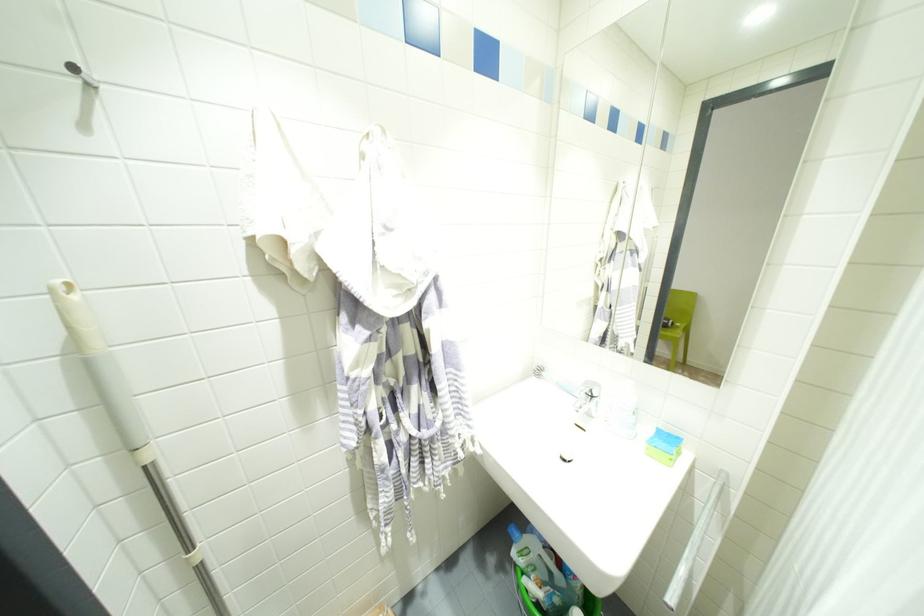
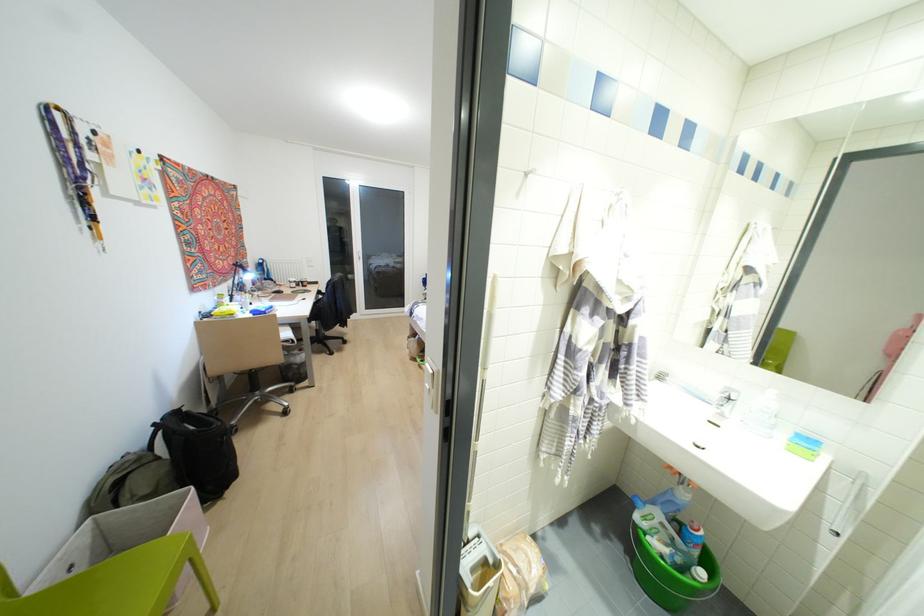
Find the pixel in the second image that matches (667,439) in the first image.

(807, 440)